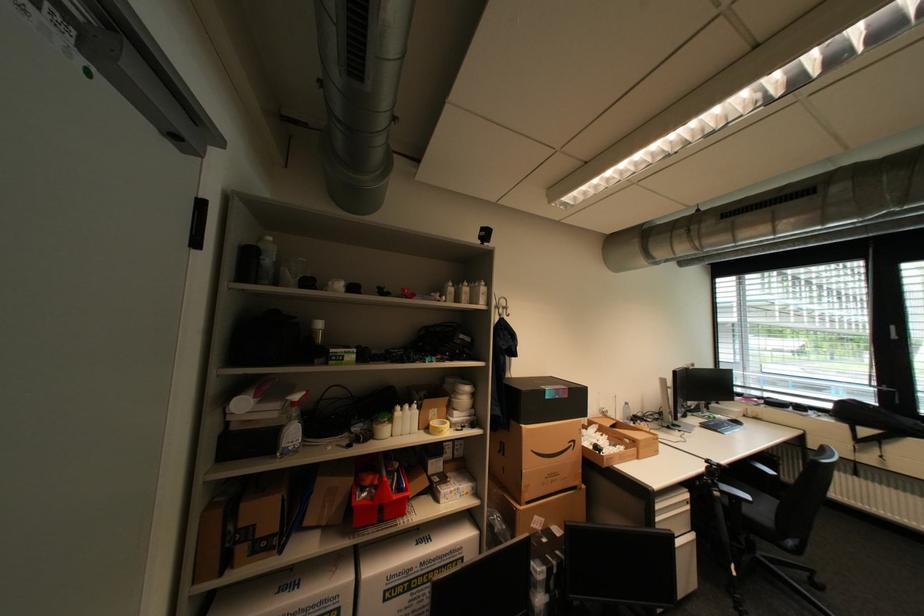
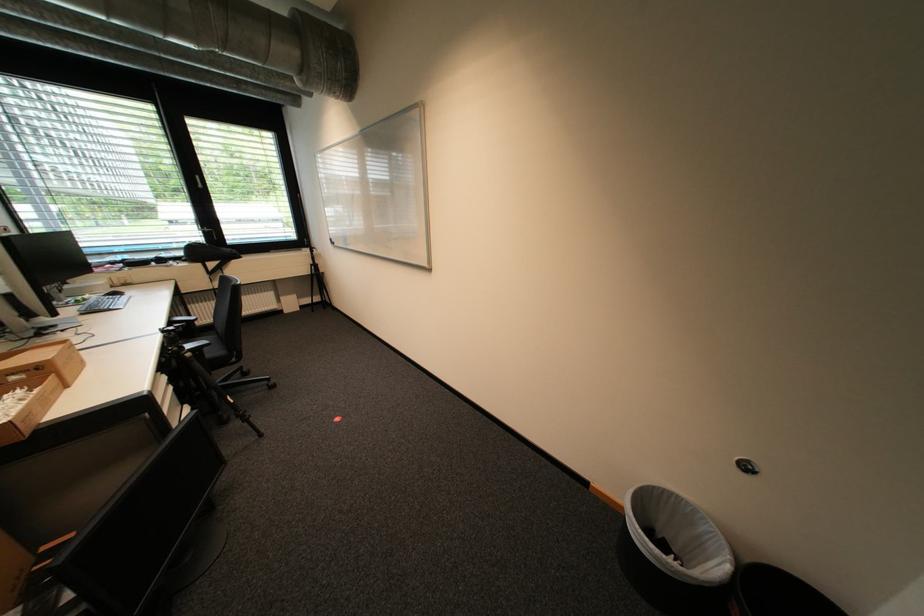
Locate, in the second image, the point that corresponds to the point at 718,418 in the first image.

(86, 302)